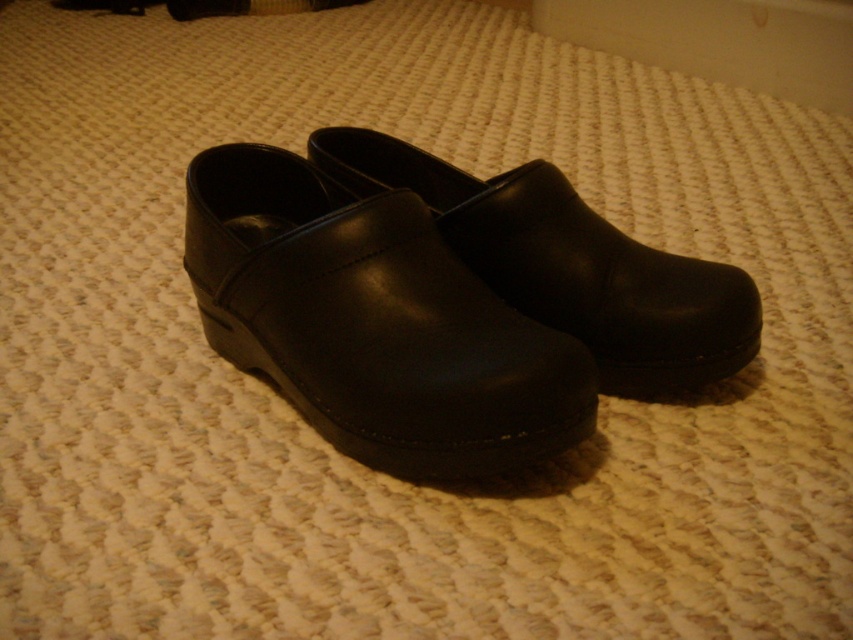
Does black leather clogs at center lie behind black leather clog at center?

No, it is not.

Between point (447, 332) and point (584, 321), which one is positioned behind?

The point (584, 321) is more distant.

Where is `black leather clogs at center`? Image resolution: width=853 pixels, height=640 pixels. black leather clogs at center is located at coordinates (373, 321).